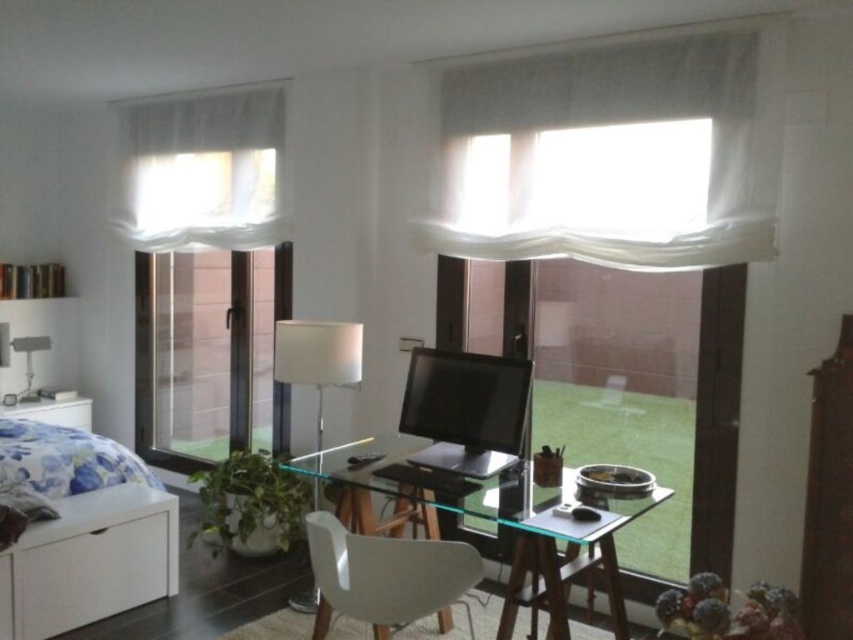
You are standing at the entrance of the room and want to place a new plant on the white glossy table at lower left. According to the image, where exactly should you place the plant?

The white glossy table at lower left is located at coordinates point (51,412), so you should place the plant there.

You are sitting at the desk and want to adjust the lighting. Which object, the white sheer curtain at upper center or the white matte lamp at left, is positioned higher and thus might block some light if closed?

The white sheer curtain at upper center is above the white matte lamp at left, so closing it might block more light due to its higher position.

You are moving a large plant into this room. You want to place it between the transparent glass computer desk at center and the white glossy table at lower left. Can you do that?

A: The transparent glass computer desk at center is positioned on the right side of white glossy table at lower left, so there is space between them to place the large plant.